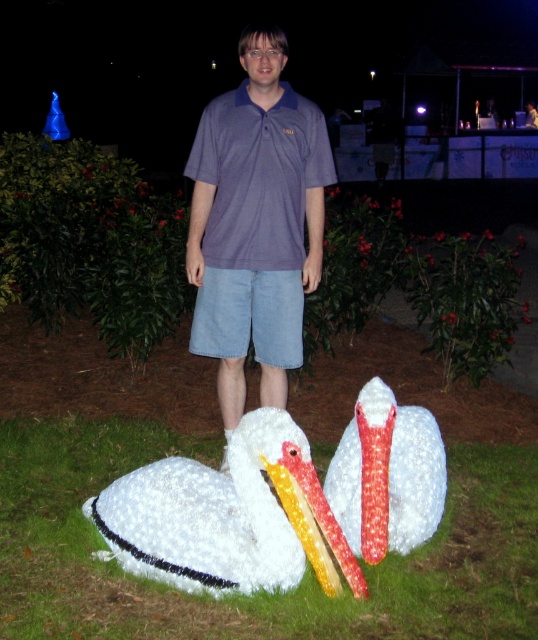
Which is below, matte purple shirt at center or white polystyrene swan at lower center?

Positioned lower is white polystyrene swan at lower center.

Can you confirm if matte purple shirt at center is positioned to the left of white polystyrene swan at lower center?

No, matte purple shirt at center is not to the left of white polystyrene swan at lower center.

At what (x,y) coordinates should I click in order to perform the action: click on matte purple shirt at center. Please return your answer as a coordinate pair (x, y). The image size is (538, 640). Looking at the image, I should click on (256, 221).

Where is `matte purple shirt at center`? The height and width of the screenshot is (640, 538). matte purple shirt at center is located at coordinates (256, 221).

This screenshot has width=538, height=640. In order to click on white fluffy grass at lower center in this screenshot , I will do `click(260, 593)`.

Does point (371, 624) come behind point (313, 198)?

No, it is in front of (313, 198).

This screenshot has width=538, height=640. Find the location of `white fluffy grass at lower center`. white fluffy grass at lower center is located at coordinates (260, 593).

Is white fluffy grass at lower center above white fluffy swan at lower left?

No.

Who is positioned more to the right, white fluffy grass at lower center or white fluffy swan at lower left?

white fluffy swan at lower left

The image size is (538, 640). What are the coordinates of `white fluffy grass at lower center` in the screenshot? It's located at (260, 593).